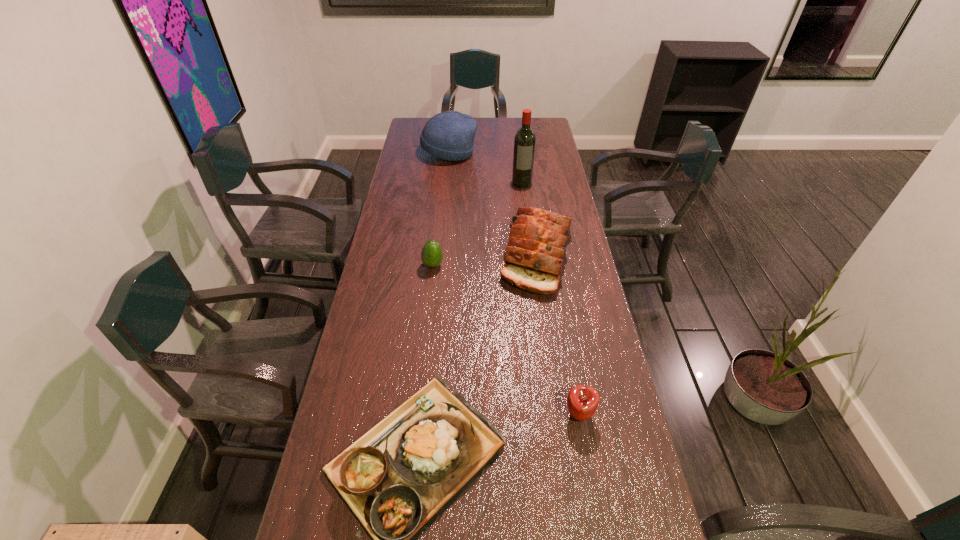
At what (x,y) coordinates should I click in order to perform the action: click on vacant space that satisfies the following two spatial constraints: 1. on the label of the apple; 2. on the left side of the tallest object. Please return your answer as a coordinate pair (x, y). The image size is (960, 540). Looking at the image, I should click on click(551, 415).